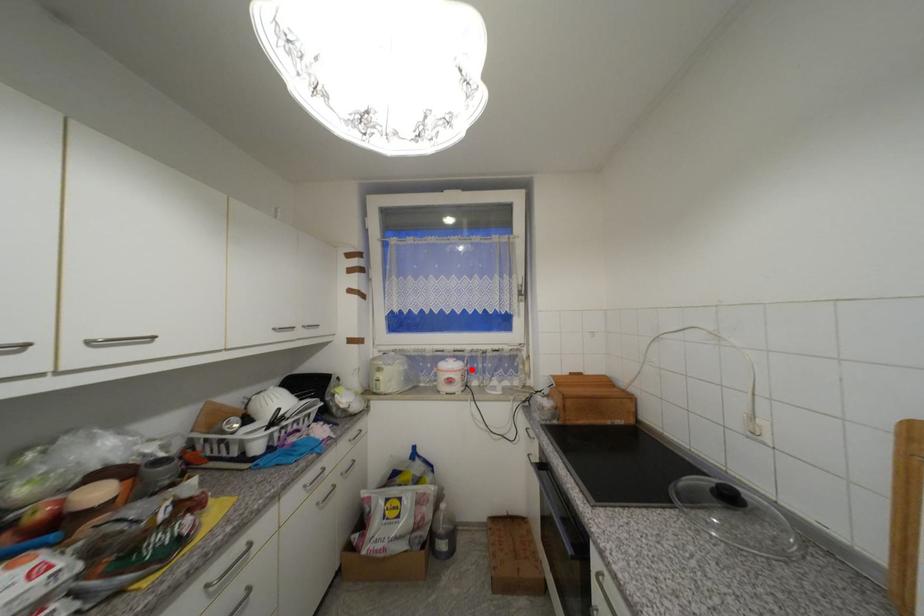
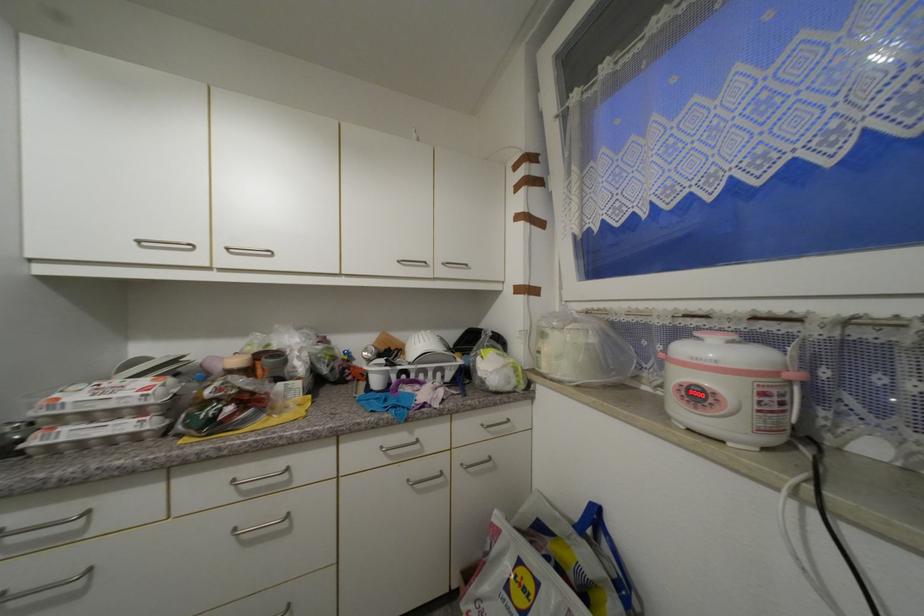
The point at the highlighted location is marked in the first image. Where is the corresponding point in the second image?

(799, 378)